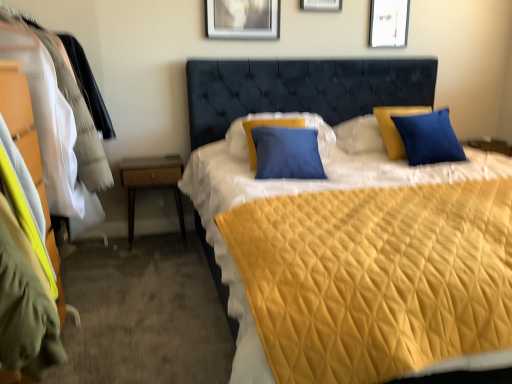
Question: Can you confirm if matte wood dresser at left is taller than white paper at upper center, positioned as the 1th picture frame in right-to-left order?

Choices:
 (A) yes
 (B) no

Answer: (A)

Question: Is matte wood dresser at left turned away from white paper at upper center, positioned as the 1th picture frame in right-to-left order?

Choices:
 (A) yes
 (B) no

Answer: (B)

Question: Considering the relative positions of matte wood dresser at left and white paper at upper center, positioned as the 1th picture frame in right-to-left order, in the image provided, is matte wood dresser at left in front of white paper at upper center, positioned as the 1th picture frame in right-to-left order,?

Choices:
 (A) no
 (B) yes

Answer: (B)

Question: From the image's perspective, is matte wood dresser at left below white paper at upper center, which is the 3th picture frame in left-to-right order?

Choices:
 (A) yes
 (B) no

Answer: (A)

Question: Can we say matte wood dresser at left lies outside white paper at upper center, positioned as the 1th picture frame in right-to-left order?

Choices:
 (A) no
 (B) yes

Answer: (B)

Question: Is matte wood dresser at left not close to white paper at upper center, positioned as the 1th picture frame in right-to-left order?

Choices:
 (A) no
 (B) yes

Answer: (B)

Question: Is metallic silver picture frame at upper center, which appears as the third picture frame when viewed from the right, to the left of matte silver picture frame at upper center, which ranks as the 2th picture frame in right-to-left order, from the viewer's perspective?

Choices:
 (A) no
 (B) yes

Answer: (B)

Question: Is metallic silver picture frame at upper center, which appears as the third picture frame when viewed from the right, not within matte silver picture frame at upper center, which ranks as the 2th picture frame in right-to-left order?

Choices:
 (A) yes
 (B) no

Answer: (A)

Question: Considering the relative positions of metallic silver picture frame at upper center, positioned as the first picture frame in left-to-right order, and matte silver picture frame at upper center, arranged as the 2th picture frame when viewed from the left, in the image provided, is metallic silver picture frame at upper center, positioned as the first picture frame in left-to-right order, behind matte silver picture frame at upper center, arranged as the 2th picture frame when viewed from the left,?

Choices:
 (A) yes
 (B) no

Answer: (B)

Question: From a real-world perspective, is metallic silver picture frame at upper center, which appears as the third picture frame when viewed from the right, below matte silver picture frame at upper center, arranged as the 2th picture frame when viewed from the left?

Choices:
 (A) no
 (B) yes

Answer: (B)

Question: Does metallic silver picture frame at upper center, positioned as the first picture frame in left-to-right order, have a lesser width compared to matte silver picture frame at upper center, which ranks as the 2th picture frame in right-to-left order?

Choices:
 (A) yes
 (B) no

Answer: (A)

Question: Can you confirm if metallic silver picture frame at upper center, positioned as the first picture frame in left-to-right order, is taller than matte silver picture frame at upper center, arranged as the 2th picture frame when viewed from the left?

Choices:
 (A) no
 (B) yes

Answer: (A)

Question: Can you confirm if blue matte pillow at center is smaller than matte silver picture frame at upper center, arranged as the 2th picture frame when viewed from the left?

Choices:
 (A) yes
 (B) no

Answer: (B)